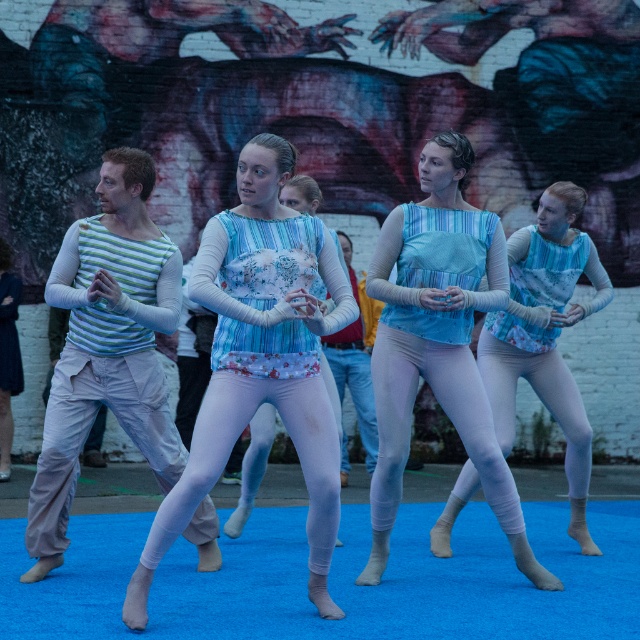
Question: Does blue floral tank top at center have a greater width compared to striped jersey at left?

Choices:
 (A) no
 (B) yes

Answer: (B)

Question: In this image, where is blue fabric dress at center located relative to blue textured tank top at center?

Choices:
 (A) above
 (B) below

Answer: (A)

Question: Is blue floral tank top at center above blue fabric dress at center?

Choices:
 (A) no
 (B) yes

Answer: (A)

Question: Which point is farther to the camera?

Choices:
 (A) blue fabric dress at center
 (B) blue floral tank top at center

Answer: (A)

Question: Which point is closer to the camera?

Choices:
 (A) blue fabric dress at center
 (B) striped jersey at left
 (C) blue textured tank top at center

Answer: (B)

Question: Considering the real-world distances, which object is farthest from the blue floral tank top at center?

Choices:
 (A) blue fabric dress at center
 (B) blue textured tank top at center

Answer: (B)